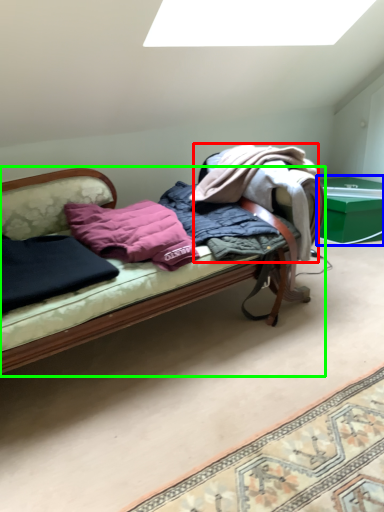
Question: Which object is the farthest from clothing (highlighted by a red box)? Choose among these: table (highlighted by a blue box) or studio couch (highlighted by a green box).

Choices:
 (A) table
 (B) studio couch

Answer: (A)